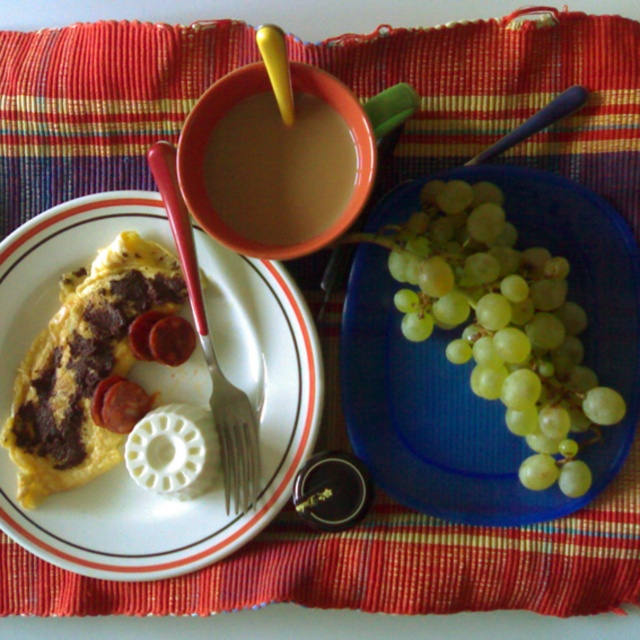
Which is more to the left, white glossy plate at upper left or green matte grapes at right?

white glossy plate at upper left is more to the left.

Does white glossy plate at upper left have a smaller size compared to green matte grapes at right?

Incorrect, white glossy plate at upper left is not smaller in size than green matte grapes at right.

Is point (8, 305) more distant than point (529, 376)?

Yes, it is.

Find the location of a particular element. This screenshot has height=640, width=640. white glossy plate at upper left is located at coordinates (214, 484).

Who is higher up, white glossy plate at upper left or brown matte cup at upper center?

brown matte cup at upper center

Between white glossy plate at upper left and brown matte cup at upper center, which one has more height?

white glossy plate at upper left

Describe the element at coordinates (214, 484) in the screenshot. This screenshot has height=640, width=640. I see `white glossy plate at upper left` at that location.

Image resolution: width=640 pixels, height=640 pixels. Find the location of `white glossy plate at upper left`. white glossy plate at upper left is located at coordinates (214, 484).

Between white glossy plate at upper left and silver metallic fork at lower left, which one is positioned higher?

silver metallic fork at lower left is above.

Which is behind, point (193, 564) or point (250, 486)?

The point (250, 486) is more distant.

The height and width of the screenshot is (640, 640). Identify the location of white glossy plate at upper left. (214, 484).